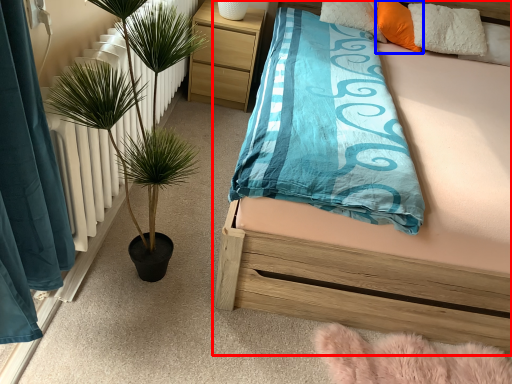
Question: Which point is further to the camera, bed (highlighted by a red box) or pillow (highlighted by a blue box)?

Choices:
 (A) bed
 (B) pillow

Answer: (B)